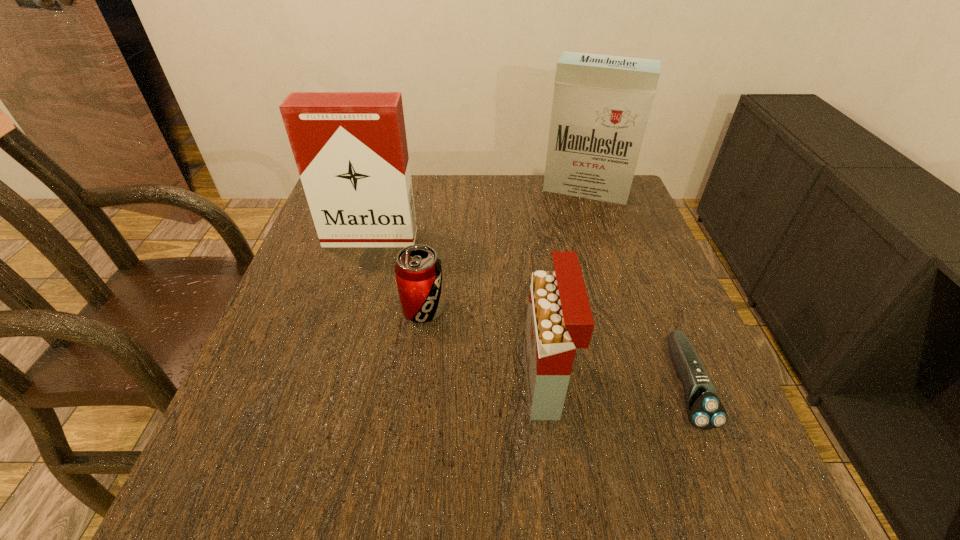
Locate which object ranks third in proximity to the shortest object. Please provide its 2D coordinates. Your answer should be formatted as a tuple, i.e. [(x, y)], where the tuple contains the x and y coordinates of a point satisfying the conditions above.

[(601, 104)]

The width and height of the screenshot is (960, 540). In order to click on cigarette case that can be found as the closest to the shortest object in this screenshot , I will do `click(559, 320)`.

Image resolution: width=960 pixels, height=540 pixels. In order to click on cigarette case that is the second closest to the shortest object in this screenshot , I will do `click(601, 104)`.

Find the location of `vacant space that satisfies the following two spatial constraints: 1. on the back side of the farthest cigarette case; 2. on the left side of the soda can`. vacant space that satisfies the following two spatial constraints: 1. on the back side of the farthest cigarette case; 2. on the left side of the soda can is located at coordinates (439, 190).

In order to click on free space that satisfies the following two spatial constraints: 1. on the front-facing side of the third nearest object; 2. on the right side of the fourth nearest object in this screenshot , I will do `click(349, 309)`.